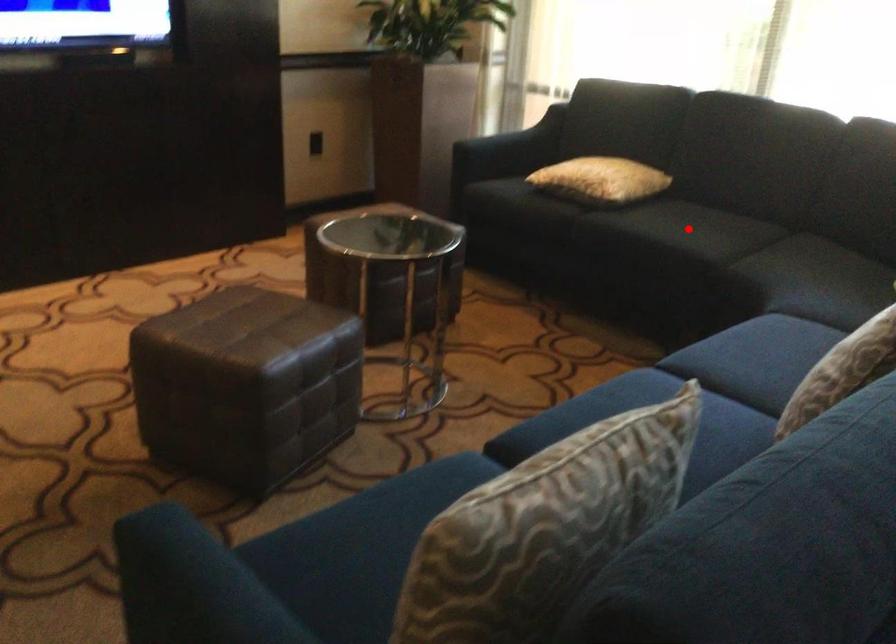
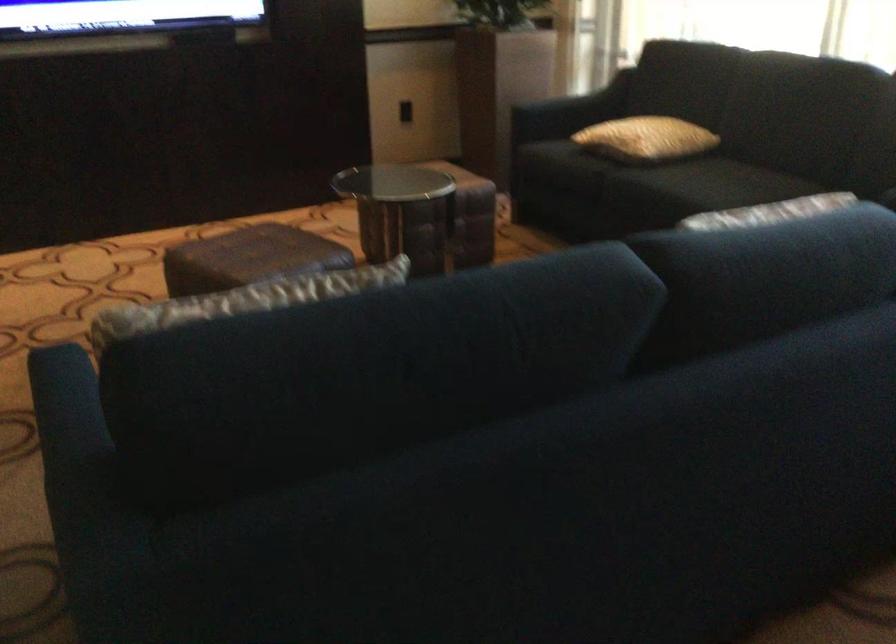
In the second image, find the point that corresponds to the highlighted location in the first image.

(709, 184)